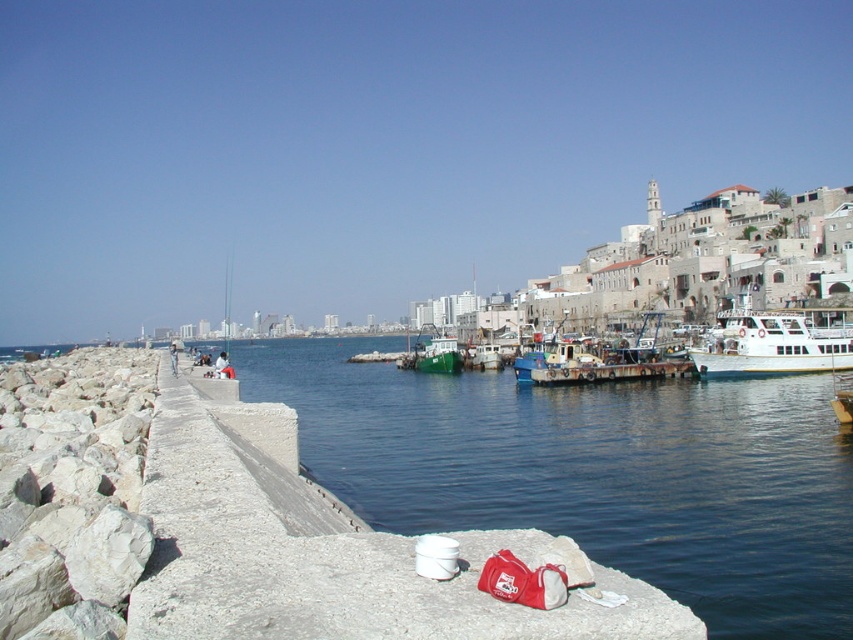
Which is in front, point (712, 403) or point (416, 353)?

Point (712, 403) is more forward.

Is concrete at left closer to the viewer compared to green matte boat at center?

Yes, concrete at left is closer to the viewer.

At what (x,y) coordinates should I click in order to perform the action: click on concrete at left. Please return your answer as a coordinate pair (x, y). The width and height of the screenshot is (853, 640). Looking at the image, I should click on (595, 472).

How much distance is there between white glossy boat at right and green matte boat at center?

white glossy boat at right is 58.80 meters from green matte boat at center.

Is point (778, 330) farther from camera compared to point (447, 369)?

No, (778, 330) is in front of (447, 369).

Who is more forward, (779, 369) or (440, 333)?

Point (779, 369) is more forward.

The width and height of the screenshot is (853, 640). Identify the location of white glossy boat at right. (772, 344).

Between point (656, 468) and point (840, 332), which one is positioned in front?

Positioned in front is point (656, 468).

Is point (676, 568) in front of point (746, 353)?

Yes, point (676, 568) is closer to viewer.

Where is `concrete at left`? concrete at left is located at coordinates (595, 472).